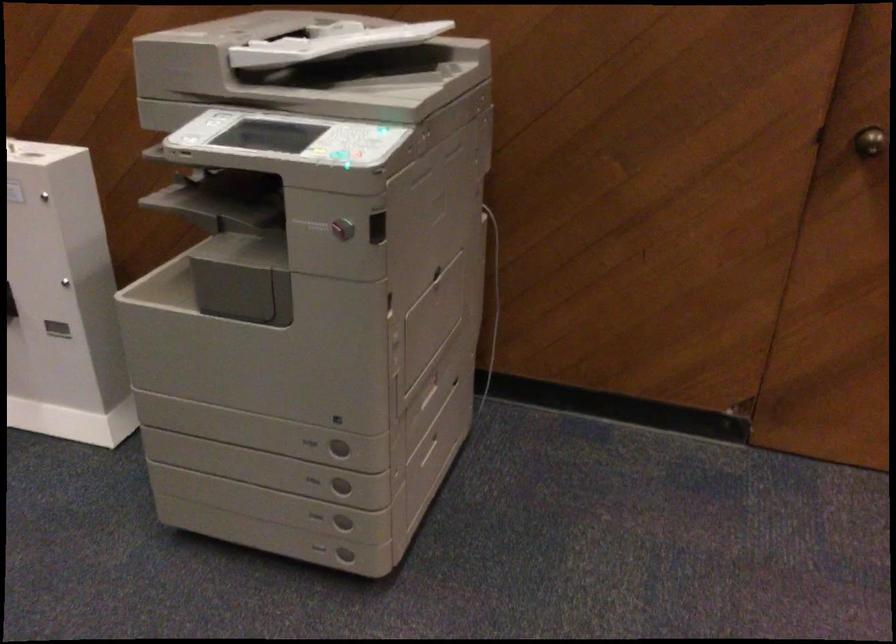
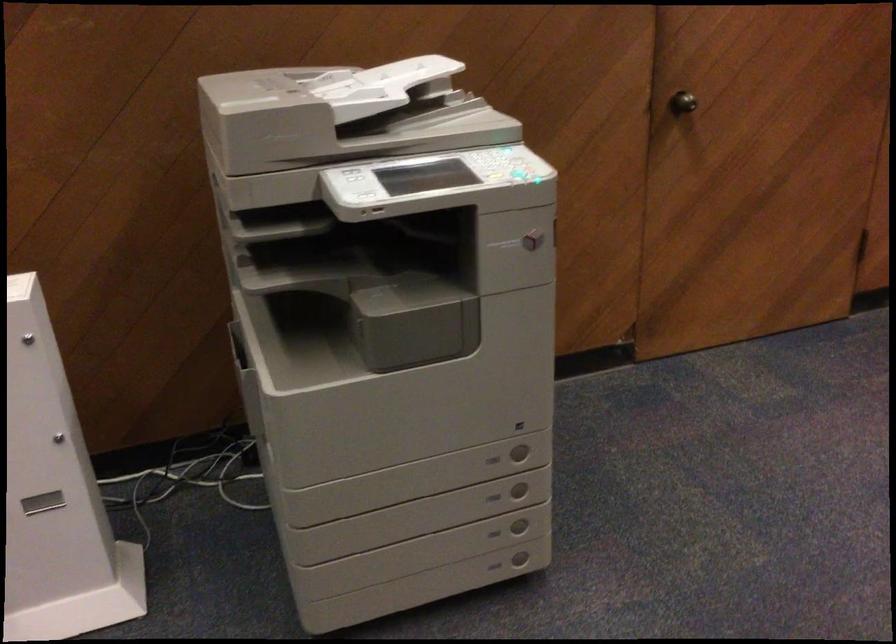
Find the pixel in the second image that matches point 340,489 in the first image.

(519, 489)